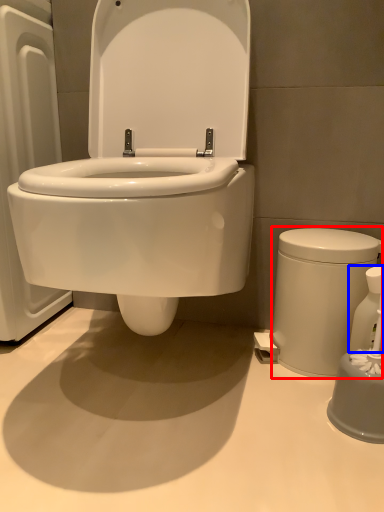
Question: Which point is closer to the camera, porcelain (highlighted by a red box) or soap dispenser (highlighted by a blue box)?

Choices:
 (A) porcelain
 (B) soap dispenser

Answer: (B)